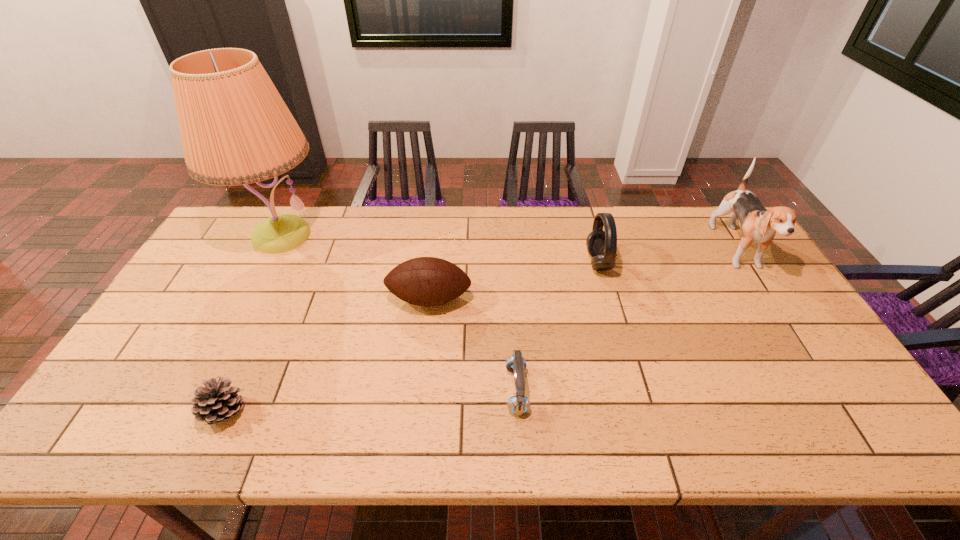
Image resolution: width=960 pixels, height=540 pixels. Identify the location of vacant space at the near edge of the desktop. (581, 438).

The height and width of the screenshot is (540, 960). What are the coordinates of `free space at the left edge` in the screenshot? It's located at (214, 261).

At what (x,y) coordinates should I click in order to perform the action: click on vacant space at the right edge of the desktop. Please return your answer as a coordinate pair (x, y). The image size is (960, 540). Looking at the image, I should click on (757, 328).

Identify the location of free space at the near left corner of the desktop. (156, 416).

This screenshot has width=960, height=540. Find the location of `free location at the far right corner`. free location at the far right corner is located at coordinates (751, 247).

The image size is (960, 540). What are the coordinates of `free area in between the football and the pinecone` in the screenshot? It's located at (327, 356).

Identify the location of vacant space that's between the rightmost object and the fourth shortest object. This screenshot has width=960, height=540. (668, 258).

Locate an element on the screen. The width and height of the screenshot is (960, 540). free space between the shorter headset and the right headset is located at coordinates (558, 327).

Where is `vacant area that lies between the pinecone and the left headset`? vacant area that lies between the pinecone and the left headset is located at coordinates click(x=371, y=402).

Find the location of `free space between the farther headset and the fourth tallest object`. free space between the farther headset and the fourth tallest object is located at coordinates [514, 281].